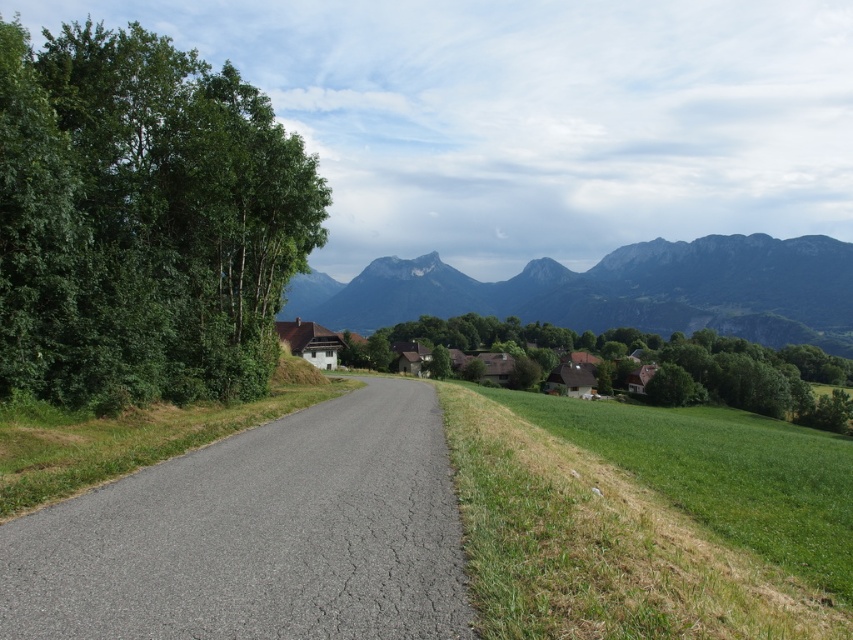
Can you confirm if green leafy tree at left is positioned to the left of green rocky mountain at upper center?

Yes, green leafy tree at left is to the left of green rocky mountain at upper center.

Does point (4, 305) come farther from viewer compared to point (764, 304)?

No, (4, 305) is closer to viewer.

Find the location of a particular element. This screenshot has width=853, height=640. green leafy tree at left is located at coordinates (142, 220).

Can you confirm if green leafy tree at left is bigger than white wooden houses at center?

Actually, green leafy tree at left might be smaller than white wooden houses at center.

Is green leafy tree at left shorter than white wooden houses at center?

Indeed, green leafy tree at left has a lesser height compared to white wooden houses at center.

Who is more distant from viewer, (50, 113) or (432, 320)?

Point (432, 320)

This screenshot has height=640, width=853. I want to click on green leafy tree at left, so click(x=142, y=220).

Who is higher up, green rocky mountain at upper center or white wooden houses at center?

green rocky mountain at upper center is above.

Is point (785, 339) closer to camera compared to point (544, 364)?

No, it is not.

At what (x,y) coordinates should I click in order to perform the action: click on green rocky mountain at upper center. Please return your answer as a coordinate pair (x, y). The image size is (853, 640). Looking at the image, I should click on (618, 291).